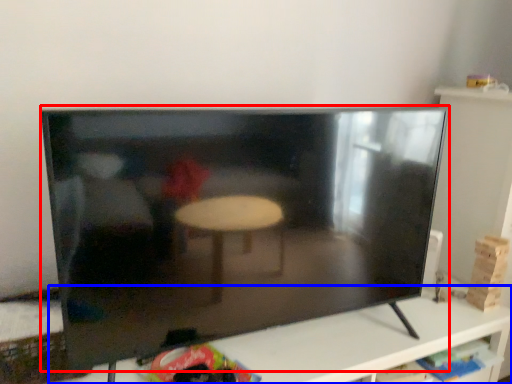
Question: Which of the following is the closest to the observer, television (highlighted by a red box) or furniture (highlighted by a blue box)?

Choices:
 (A) television
 (B) furniture

Answer: (A)